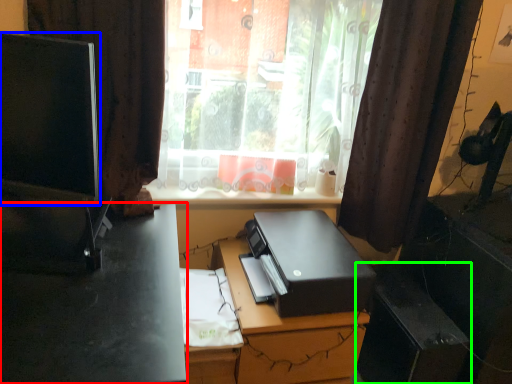
Question: Estimate the real-world distances between objects in this image. Which object is closer to desk (highlighted by a red box), computer monitor (highlighted by a blue box) or file cabinet (highlighted by a green box)?

Choices:
 (A) computer monitor
 (B) file cabinet

Answer: (A)